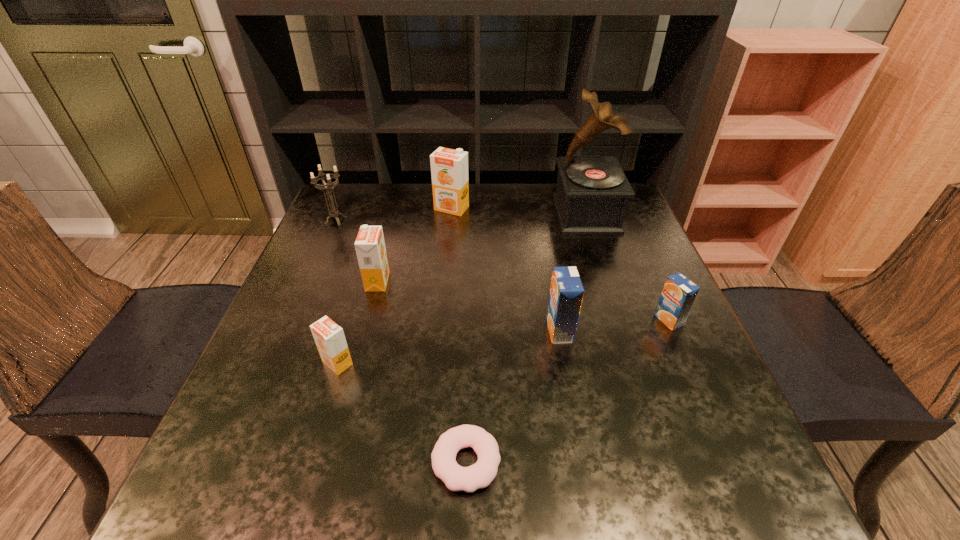
In order to click on phonograph_record present at the right edge in this screenshot , I will do `click(592, 192)`.

Find the location of a particular element. The image size is (960, 540). orange_juice positioned at the right edge is located at coordinates (679, 293).

I want to click on object at the far left corner, so click(334, 213).

Locate an element on the screen. object located at the far right corner is located at coordinates (592, 192).

You are a GUI agent. You are given a task and a screenshot of the screen. Output one action in this format:
    pyautogui.click(x=<x>, y=<y>)
    Task: Click on the vacant space at the far edge
    The height and width of the screenshot is (540, 960).
    Given the screenshot: What is the action you would take?
    pyautogui.click(x=491, y=217)

Where is `vacant space at the near edge of the desktop`? This screenshot has height=540, width=960. vacant space at the near edge of the desktop is located at coordinates (321, 470).

The width and height of the screenshot is (960, 540). Identify the location of free space at the left edge of the desktop. (266, 457).

Locate an element on the screen. The image size is (960, 540). free space at the right edge is located at coordinates (702, 353).

Locate an element on the screen. The image size is (960, 540). free spot between the smallest orange orange juice and the smaller blue orange_juice is located at coordinates (503, 342).

Locate an element on the screen. The width and height of the screenshot is (960, 540). free space that is in between the phonograph_record and the rightmost orange juice is located at coordinates (628, 267).